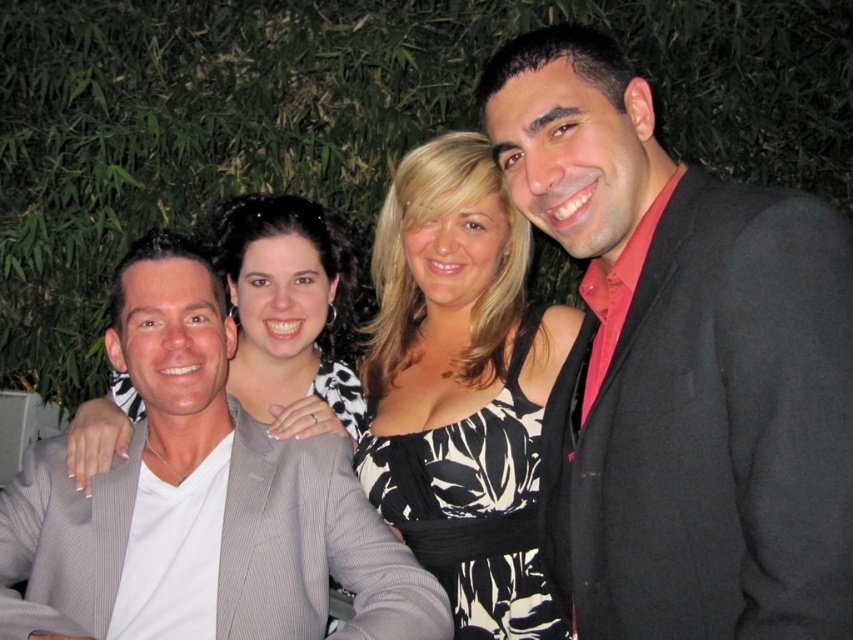
What do you see at coordinates (682, 365) in the screenshot? The height and width of the screenshot is (640, 853). I see `black matte suit at right` at bounding box center [682, 365].

Is the position of black matte suit at right less distant than that of gray pinstripe suit at left?

Yes, it is.

This screenshot has width=853, height=640. I want to click on black matte suit at right, so click(682, 365).

Identify the location of black matte suit at right. (682, 365).

Where is `gray pinstripe suit at left`? gray pinstripe suit at left is located at coordinates (199, 500).

Is gray pinstripe suit at left taller than black printed dress at center?

No.

Does point (175, 621) lie behind point (473, 269)?

No, (175, 621) is closer to viewer.

Identify the location of gray pinstripe suit at left. The width and height of the screenshot is (853, 640). (199, 500).

From the picture: Who is positioned more to the right, black matte suit at right or black printed dress at center?

From the viewer's perspective, black matte suit at right appears more on the right side.

Is black matte suit at right below black printed dress at center?

Actually, black matte suit at right is above black printed dress at center.

Image resolution: width=853 pixels, height=640 pixels. In order to click on black matte suit at right in this screenshot , I will do `click(682, 365)`.